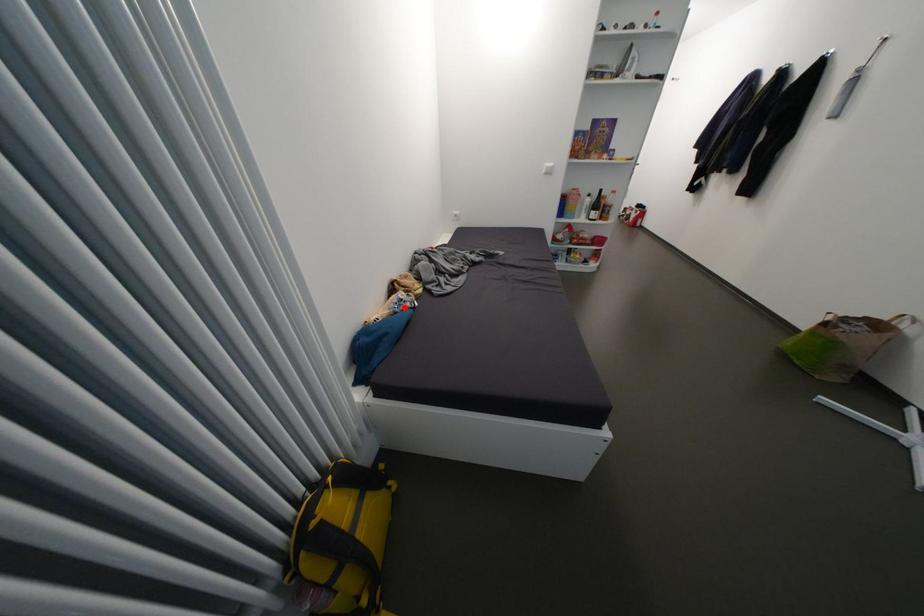
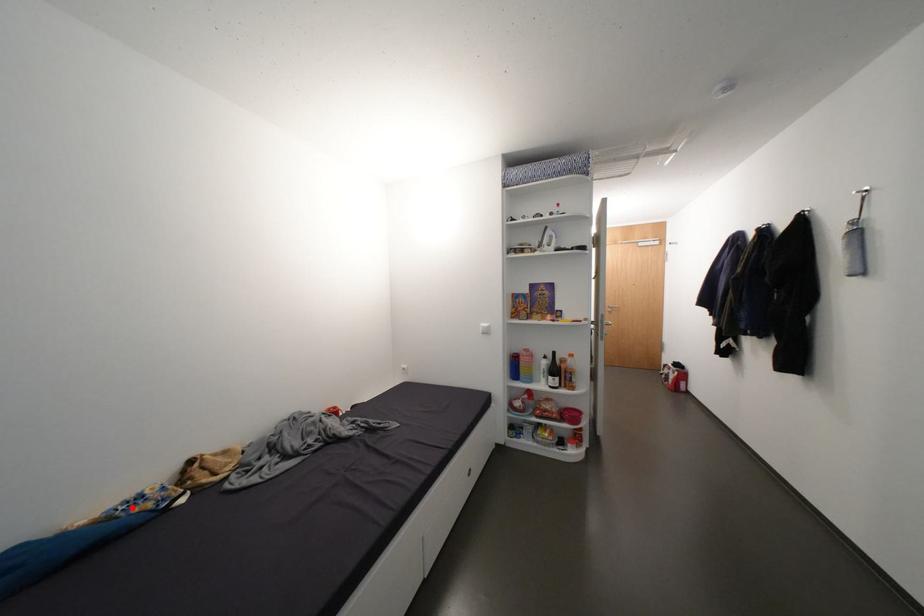
I am providing you with two images of the same scene from different viewpoints. A red point is marked on the first image and another point is marked on the second image. Are the points marked in image1 and image2 representing the same 3D position?

Yes